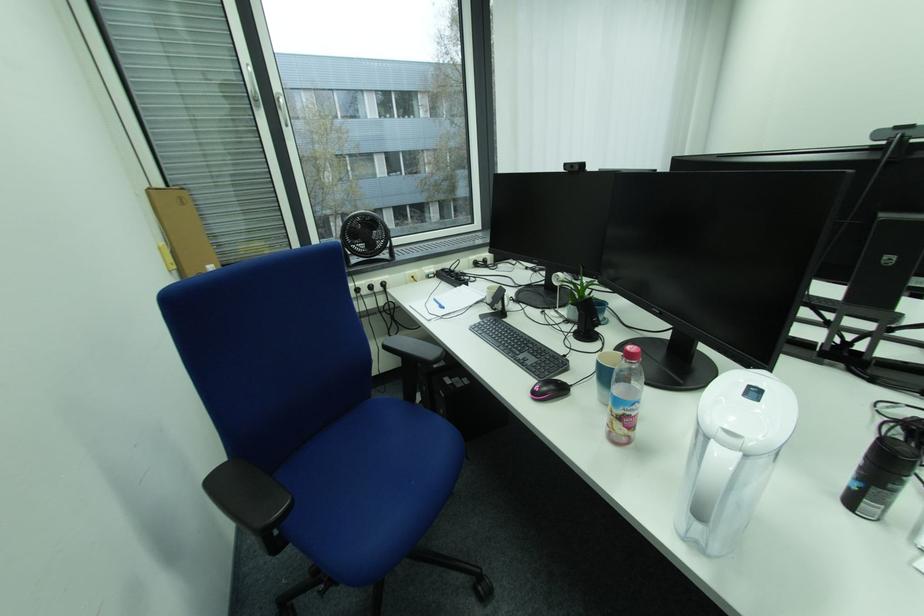
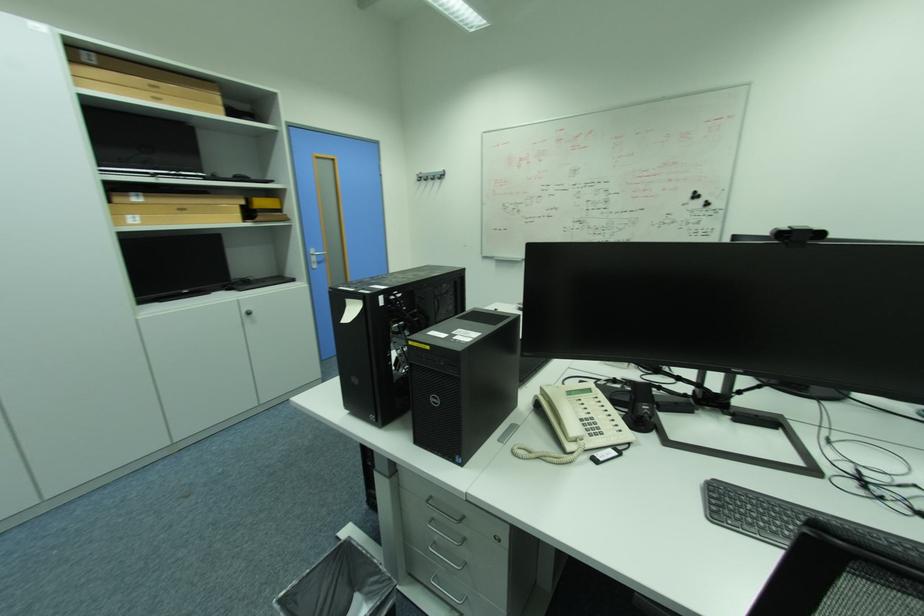
Question: I am providing you with two images of the same scene from different viewpoints. Which of the following objects are not visible in image2?

Choices:
 (A) beige phone handset
 (B) silver drawer handle
 (C) dark jug handle
 (D) pink computer mouse

Answer: (D)